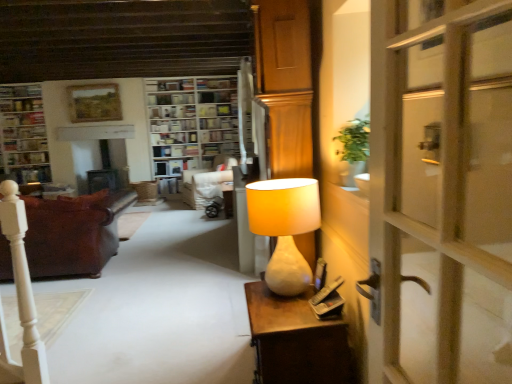
Locate an element on the screen. The image size is (512, 384). free space underneath matte white lamp at right (from a real-world perspective) is located at coordinates (272, 294).